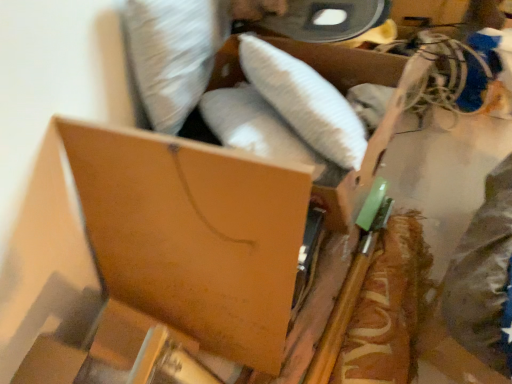
The height and width of the screenshot is (384, 512). Describe the element at coordinates (347, 88) in the screenshot. I see `brown cardboard box at upper center, which ranks as the first storage box in top-to-bottom order` at that location.

The width and height of the screenshot is (512, 384). Describe the element at coordinates (388, 308) in the screenshot. I see `wooden spatula at right` at that location.

At what (x,y) coordinates should I click in order to perform the action: click on brown cardboard box at upper center, which ranks as the first storage box in top-to-bottom order. Please return your answer as a coordinate pair (x, y). Looking at the image, I should click on (347, 88).

Could you tell me if wooden spatula at right is facing brown cardboard box at center, which is the 2th storage box from top to bottom?

No, wooden spatula at right does not turn towards brown cardboard box at center, which is the 2th storage box from top to bottom.

Is wooden spatula at right positioned in front of brown cardboard box at center, the 1th storage box in the bottom-to-top sequence?

No.

Which object is wider, wooden spatula at right or brown cardboard box at center, the 1th storage box in the bottom-to-top sequence?

brown cardboard box at center, the 1th storage box in the bottom-to-top sequence.

Based on the photo, what's the angular difference between wooden spatula at right and brown cardboard box at center, the 1th storage box in the bottom-to-top sequence,'s facing directions?

6.43 degrees.

Is brown cardboard box at center, which is the 2th storage box from top to bottom, bigger or smaller than wooden spatula at right?

Considering their sizes, brown cardboard box at center, which is the 2th storage box from top to bottom, takes up more space than wooden spatula at right.

Which of these two, brown cardboard box at center, which is the 2th storage box from top to bottom, or wooden spatula at right, stands taller?

With more height is brown cardboard box at center, which is the 2th storage box from top to bottom.

Find the location of a particular element. storage box that is the 1st one above the wooden spatula at right (from a real-world perspective) is located at coordinates click(160, 239).

Which of these two, brown cardboard box at center, which is the 2th storage box from top to bottom, or wooden spatula at right, is thinner?

wooden spatula at right is thinner.

Choose the correct answer: Is brown cardboard box at upper center, acting as the 2th storage box starting from the bottom, inside wooden spatula at right or outside it?

brown cardboard box at upper center, acting as the 2th storage box starting from the bottom, is outside wooden spatula at right.

From the image's perspective, is brown cardboard box at upper center, acting as the 2th storage box starting from the bottom, over wooden spatula at right?

Correct, brown cardboard box at upper center, acting as the 2th storage box starting from the bottom, appears higher than wooden spatula at right in the image.

Is point (320, 69) farther from viewer compared to point (364, 325)?

That is True.

Is brown cardboard box at upper center, which ranks as the first storage box in top-to-bottom order, positioned in front of brown cardboard box at center, which is the 2th storage box from top to bottom?

No.

Considering the relative sizes of brown cardboard box at upper center, acting as the 2th storage box starting from the bottom, and brown cardboard box at center, the 1th storage box in the bottom-to-top sequence, in the image provided, is brown cardboard box at upper center, acting as the 2th storage box starting from the bottom, taller than brown cardboard box at center, the 1th storage box in the bottom-to-top sequence,?

No, brown cardboard box at upper center, acting as the 2th storage box starting from the bottom, is not taller than brown cardboard box at center, the 1th storage box in the bottom-to-top sequence.

Considering the points (365, 173) and (154, 221), which point is in front, point (365, 173) or point (154, 221)?

The point (154, 221) is closer to the camera.

Is brown cardboard box at upper center, acting as the 2th storage box starting from the bottom, positioned far away from brown cardboard box at center, which is the 2th storage box from top to bottom?

No.

Is wooden spatula at right inside or outside of brown cardboard box at upper center, which ranks as the first storage box in top-to-bottom order?

wooden spatula at right is located beyond the bounds of brown cardboard box at upper center, which ranks as the first storage box in top-to-bottom order.

Relative to brown cardboard box at upper center, which ranks as the first storage box in top-to-bottom order, is wooden spatula at right in front or behind?

wooden spatula at right is positioned farther from the viewer than brown cardboard box at upper center, which ranks as the first storage box in top-to-bottom order.

Could you tell me if wooden spatula at right is turned towards brown cardboard box at upper center, which ranks as the first storage box in top-to-bottom order?

No.

From a real-world perspective, is brown cardboard box at center, the 1th storage box in the bottom-to-top sequence, located beneath brown cardboard box at upper center, which ranks as the first storage box in top-to-bottom order?

Yes.

Are brown cardboard box at center, which is the 2th storage box from top to bottom, and brown cardboard box at upper center, acting as the 2th storage box starting from the bottom, beside each other?

brown cardboard box at center, which is the 2th storage box from top to bottom, and brown cardboard box at upper center, acting as the 2th storage box starting from the bottom, are clearly separated.

What's the angular difference between brown cardboard box at center, which is the 2th storage box from top to bottom, and brown cardboard box at upper center, acting as the 2th storage box starting from the bottom,'s facing directions?

There is a 51.4-degree angle between the facing directions of brown cardboard box at center, which is the 2th storage box from top to bottom, and brown cardboard box at upper center, acting as the 2th storage box starting from the bottom.

From the image's perspective, which is below, brown cardboard box at center, which is the 2th storage box from top to bottom, or brown cardboard box at upper center, which ranks as the first storage box in top-to-bottom order?

brown cardboard box at center, which is the 2th storage box from top to bottom, from the image's perspective.

There is a wooden spatula at right. Where is `the 1st storage box above it (from a real-world perspective)`? This screenshot has width=512, height=384. the 1st storage box above it (from a real-world perspective) is located at coordinates (160, 239).

Find the location of a particular element. storage box that is the 2nd object located in front of the wooden spatula at right is located at coordinates (160, 239).

Looking at the image, which one is located further to brown cardboard box at center, the 1th storage box in the bottom-to-top sequence, wooden spatula at right or brown cardboard box at upper center, which ranks as the first storage box in top-to-bottom order?

Based on the image, wooden spatula at right appears to be further to brown cardboard box at center, the 1th storage box in the bottom-to-top sequence.

Considering their positions, is brown cardboard box at center, the 1th storage box in the bottom-to-top sequence, positioned closer to brown cardboard box at upper center, acting as the 2th storage box starting from the bottom, than wooden spatula at right?

Among the two, wooden spatula at right is located nearer to brown cardboard box at upper center, acting as the 2th storage box starting from the bottom.

When comparing their distances from brown cardboard box at upper center, acting as the 2th storage box starting from the bottom, does wooden spatula at right or brown cardboard box at center, which is the 2th storage box from top to bottom, seem closer?

Among the two, wooden spatula at right is located nearer to brown cardboard box at upper center, acting as the 2th storage box starting from the bottom.

Which object lies further to the anchor point wooden spatula at right, brown cardboard box at center, the 1th storage box in the bottom-to-top sequence, or brown cardboard box at upper center, acting as the 2th storage box starting from the bottom?

Among the two, brown cardboard box at center, the 1th storage box in the bottom-to-top sequence, is located further to wooden spatula at right.

When comparing their distances from brown cardboard box at center, the 1th storage box in the bottom-to-top sequence, does brown cardboard box at upper center, acting as the 2th storage box starting from the bottom, or wooden spatula at right seem further?

Based on the image, wooden spatula at right appears to be further to brown cardboard box at center, the 1th storage box in the bottom-to-top sequence.

From the image, which object appears to be farther from wooden spatula at right, brown cardboard box at upper center, acting as the 2th storage box starting from the bottom, or brown cardboard box at center, which is the 2th storage box from top to bottom?

brown cardboard box at center, which is the 2th storage box from top to bottom.

Where is `storage box situated between brown cardboard box at center, the 1th storage box in the bottom-to-top sequence, and wooden spatula at right from left to right`? storage box situated between brown cardboard box at center, the 1th storage box in the bottom-to-top sequence, and wooden spatula at right from left to right is located at coordinates (347, 88).